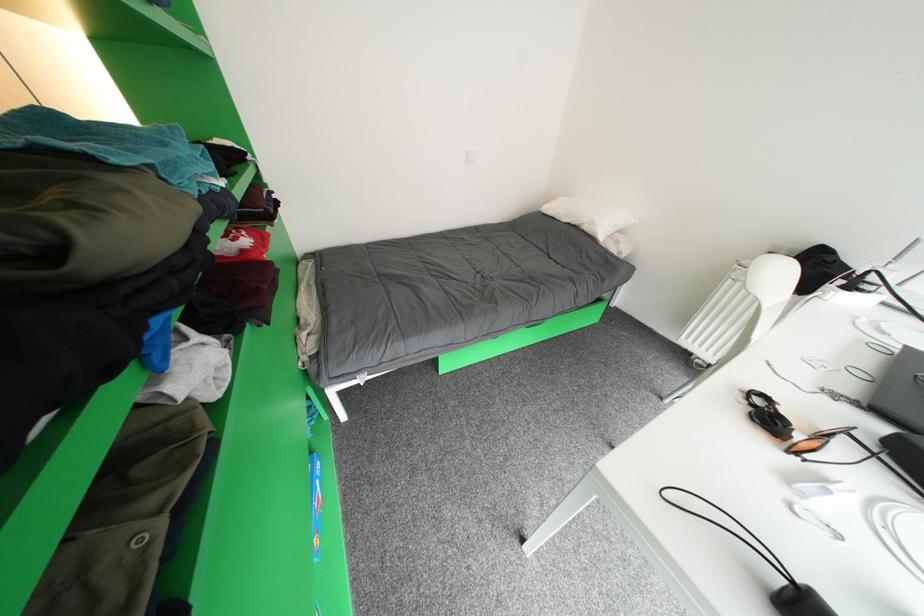
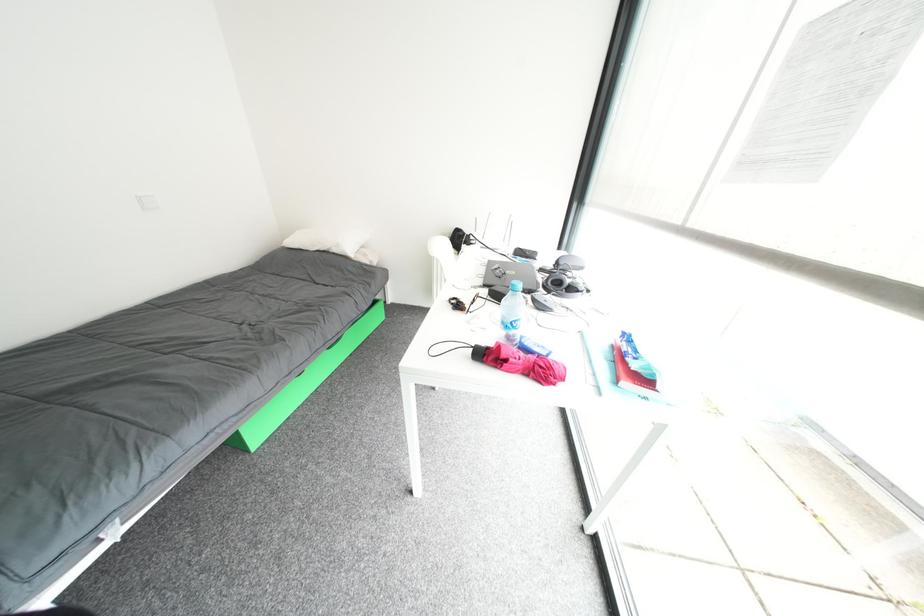
Question: Based on the continuous images, in which direction is the camera rotating? Reply with the corresponding letter.

Choices:
 (A) Left
 (B) Right
 (C) Up
 (D) Down

Answer: (B)